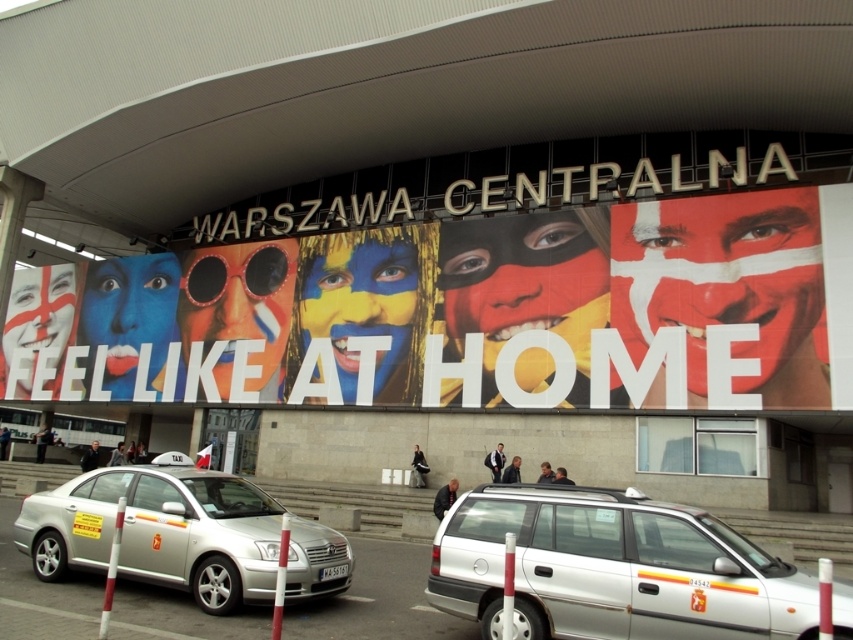
Is point (550, 621) more distant than point (129, 520)?

That is False.

The image size is (853, 640). Find the location of `silver metallic station wagon at center`. silver metallic station wagon at center is located at coordinates (611, 568).

Who is more distant from viewer, (465, 563) or (209, 481)?

The point (209, 481) is more distant.

Locate an element on the screen. The image size is (853, 640). silver metallic station wagon at center is located at coordinates (611, 568).

Measure the distance between multicolored painted faces at center and silver metallic station wagon at center.

The distance of multicolored painted faces at center from silver metallic station wagon at center is 29.93 meters.

This screenshot has width=853, height=640. In order to click on multicolored painted faces at center in this screenshot , I will do `click(468, 310)`.

Which is behind, point (527, 326) or point (340, 536)?

The point (527, 326) is more distant.

Who is more distant from viewer, [717,321] or [184,465]?

Point [717,321]

The height and width of the screenshot is (640, 853). I want to click on multicolored painted faces at center, so click(x=468, y=310).